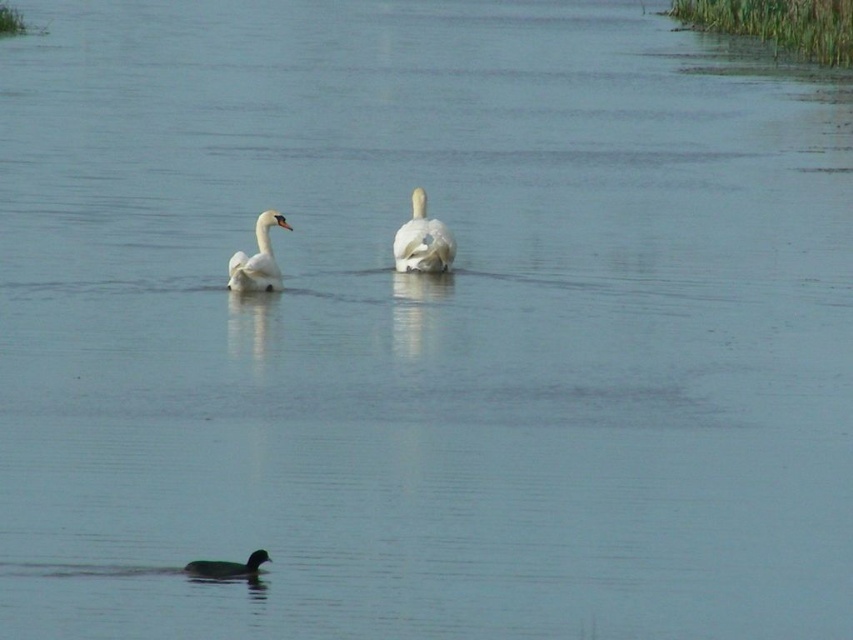
You are standing at the center of the image and want to walk towards the nearest point between point (408, 227) and point (248, 282). Which point should you walk towards?

Point (248, 282) is closer to the center of the image, so you should walk towards point (248, 282).